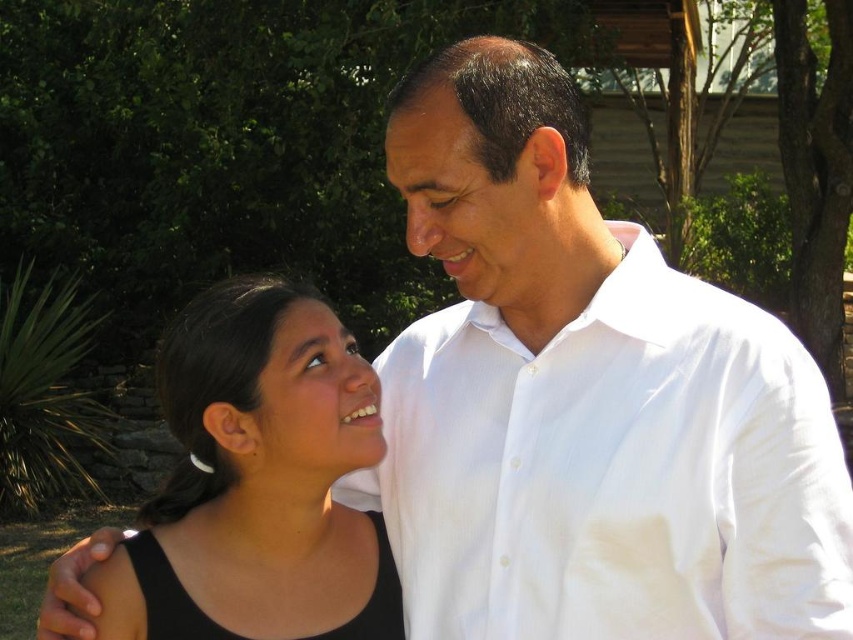
Which is in front, point (515, 598) or point (235, 544)?

Point (515, 598) is more forward.

This screenshot has height=640, width=853. What do you see at coordinates (613, 470) in the screenshot? I see `white cotton shirt at upper right` at bounding box center [613, 470].

The width and height of the screenshot is (853, 640). What are the coordinates of `white cotton shirt at upper right` in the screenshot? It's located at (613, 470).